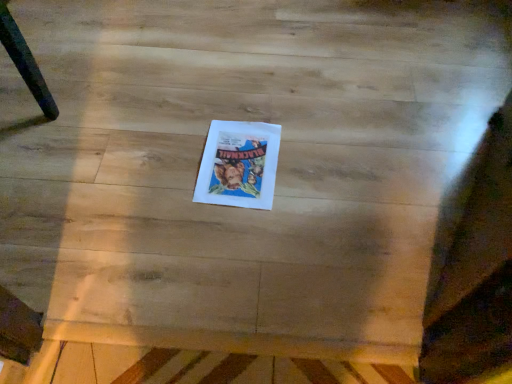
In order to click on white paper at center in this screenshot , I will do `click(239, 165)`.

What do you see at coordinates (239, 165) in the screenshot? The width and height of the screenshot is (512, 384). I see `white paper at center` at bounding box center [239, 165].

You are a GUI agent. You are given a task and a screenshot of the screen. Output one action in this format:
    pyautogui.click(x=<x>, y=<y>)
    Task: Click on the white paper at center
    This screenshot has height=384, width=512.
    Given the screenshot: What is the action you would take?
    pyautogui.click(x=239, y=165)